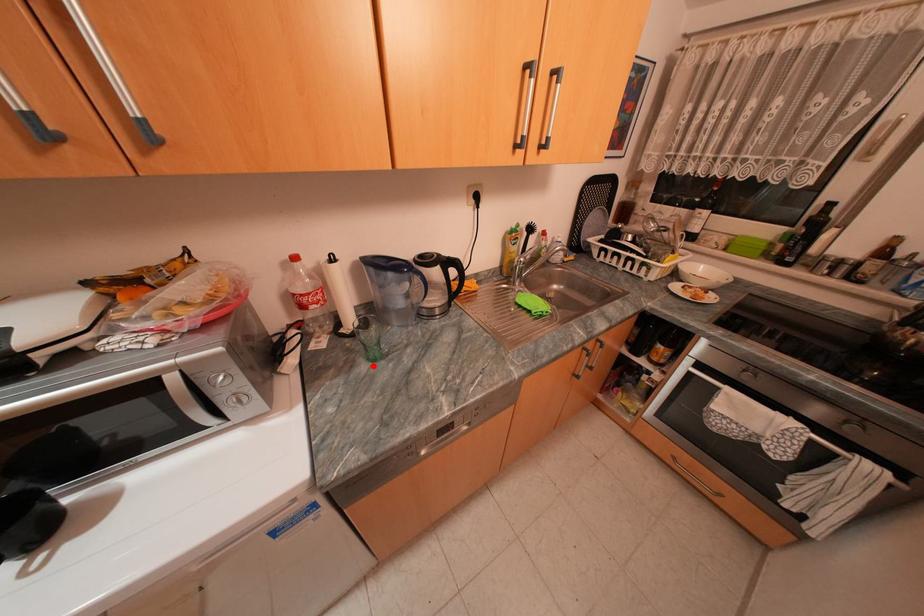
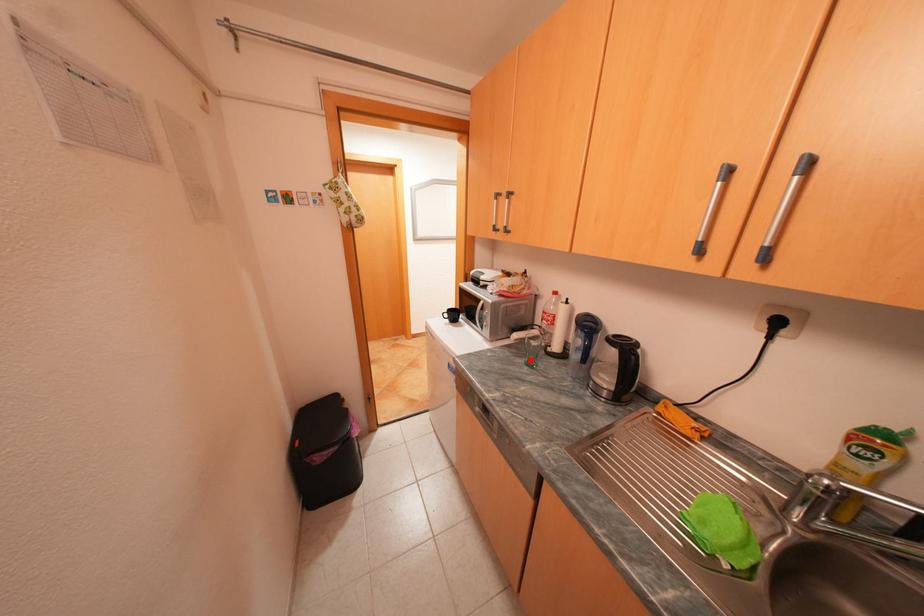
I am providing you with two images of the same scene from different viewpoints. A red point is marked on the first image and another point is marked on the second image. Are the points marked in image1 and image2 representing the same 3D position?

Yes